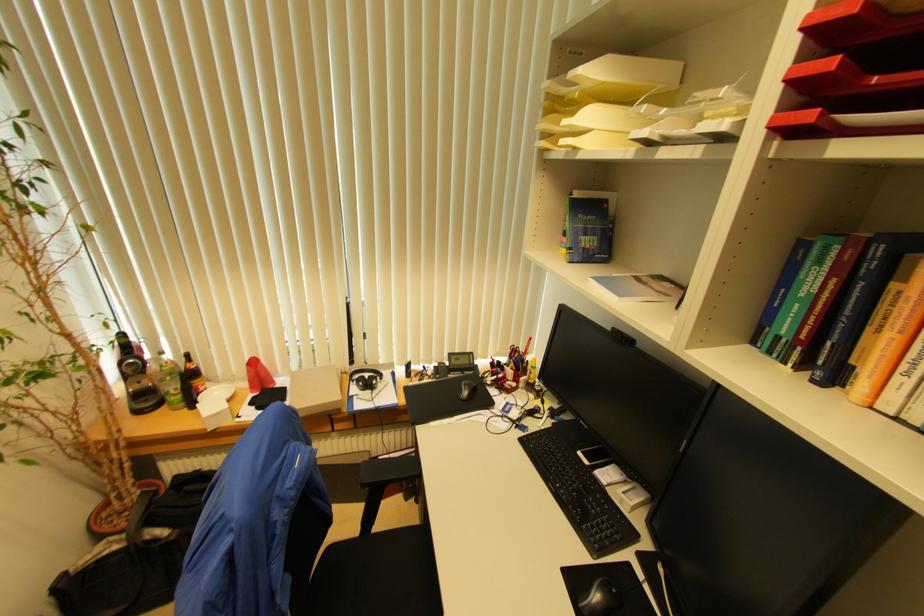
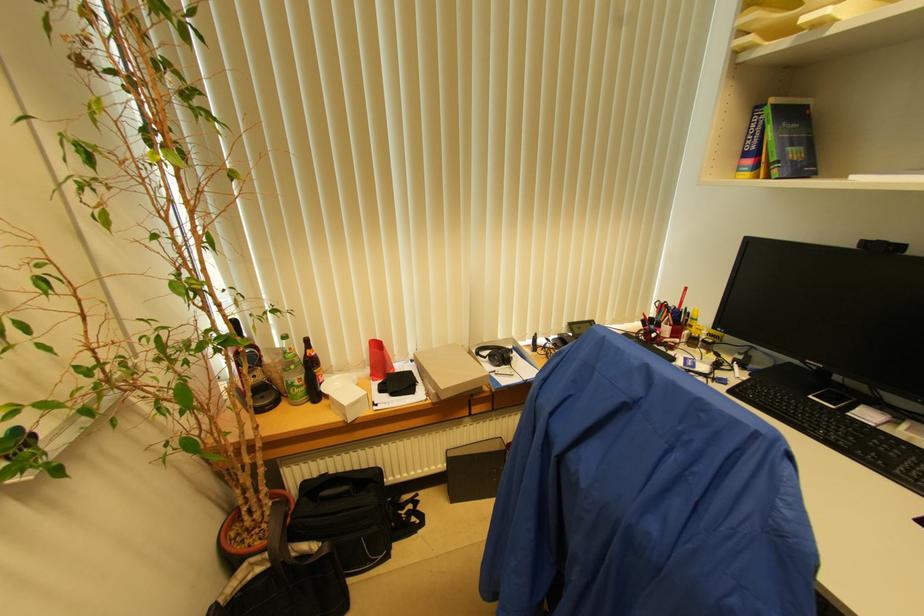
Where in the second image is the point corresponding to pixel 130 541 from the first image?

(273, 561)